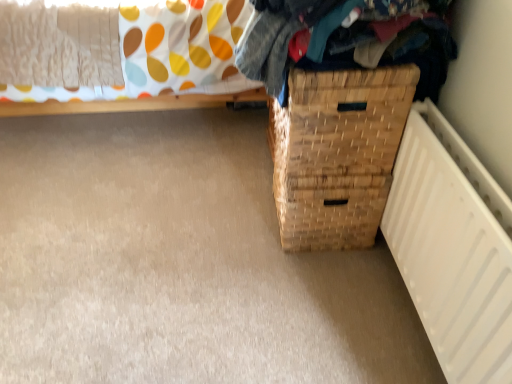
Where is `vacant space in front of woven wood basket at lower right`? Image resolution: width=512 pixels, height=384 pixels. vacant space in front of woven wood basket at lower right is located at coordinates (315, 288).